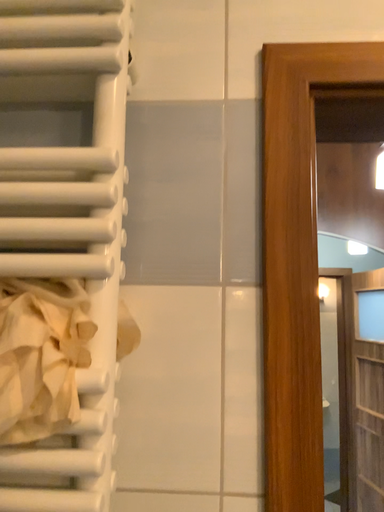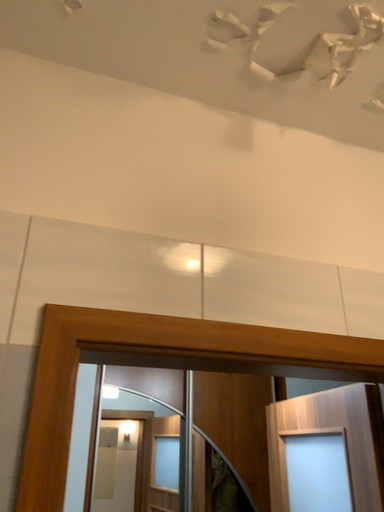
Question: How did the camera likely rotate when shooting the video?

Choices:
 (A) rotated upward
 (B) rotated downward

Answer: (A)